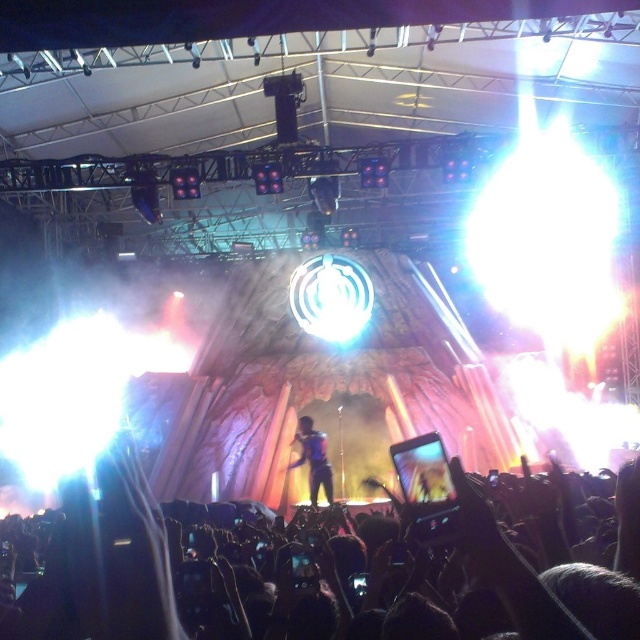
Question: Can you confirm if black matte crowd at lower center is positioned above metallic blue suit at center?

Choices:
 (A) no
 (B) yes

Answer: (B)

Question: Which point appears farthest from the camera in this image?

Choices:
 (A) (314, 486)
 (B) (56, 566)

Answer: (A)

Question: From the image, what is the correct spatial relationship of black matte crowd at lower center in relation to metallic blue suit at center?

Choices:
 (A) below
 (B) above

Answer: (B)

Question: Which of the following is the closest to the observer?

Choices:
 (A) (320, 461)
 (B) (161, 544)

Answer: (B)

Question: Among these objects, which one is nearest to the camera?

Choices:
 (A) metallic blue suit at center
 (B) black matte crowd at lower center

Answer: (B)

Question: Does black matte crowd at lower center have a greater width compared to metallic blue suit at center?

Choices:
 (A) yes
 (B) no

Answer: (A)